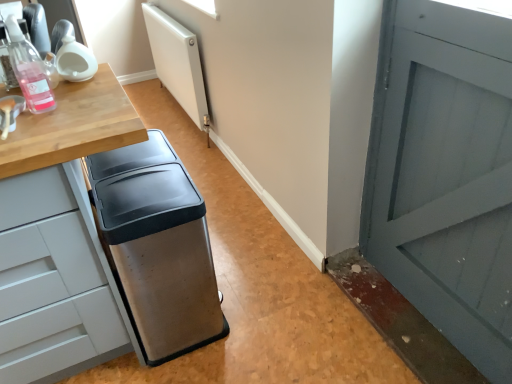
What do you see at coordinates (158, 246) in the screenshot? I see `stainless steel trash can at center` at bounding box center [158, 246].

In order to face stainless steel trash can at center, should I rotate leftwards or rightwards?

Rotate left and turn 13.049 degrees.

Identify the location of translucent plastic bottle at left. The height and width of the screenshot is (384, 512). (29, 70).

Where is `stainless steel trash can at center`? stainless steel trash can at center is located at coordinates (158, 246).

From the image's perspective, relative to white matte radiator at upper center, is translucent plastic bottle at left above or below?

translucent plastic bottle at left is below white matte radiator at upper center.

Is translucent plastic bottle at left far from white matte radiator at upper center?

translucent plastic bottle at left is far away from white matte radiator at upper center.

The image size is (512, 384). I want to click on bottle below the white matte radiator at upper center (from the image's perspective), so click(29, 70).

From a real-world perspective, is white matte radiator at upper center on top of stainless steel trash can at center?

Indeed, from a real-world perspective, white matte radiator at upper center stands above stainless steel trash can at center.

How different are the orientations of white matte radiator at upper center and stainless steel trash can at center in degrees?

They differ by 180 degrees in their facing directions.

Would you say white matte radiator at upper center is outside stainless steel trash can at center?

Yes, white matte radiator at upper center is not within stainless steel trash can at center.

Between white matte radiator at upper center and stainless steel trash can at center, which one appears on the right side from the viewer's perspective?

stainless steel trash can at center is more to the right.

Does stainless steel trash can at center turn towards white matte radiator at upper center?

No, stainless steel trash can at center is not facing towards white matte radiator at upper center.

Is point (192, 260) more distant than point (183, 72)?

That is False.

Locate an element on the screen. The image size is (512, 384). radiator above the stainless steel trash can at center (from the image's perspective) is located at coordinates (178, 64).

From a real-world perspective, is stainless steel trash can at center physically located above or below white matte radiator at upper center?

Clearly, from a real-world perspective, stainless steel trash can at center is below white matte radiator at upper center.

In the scene shown: From the image's perspective, is white matte radiator at upper center on translucent plastic bottle at left?

Indeed, from the image's perspective, white matte radiator at upper center is shown above translucent plastic bottle at left.

Which is nearer, (157, 56) or (11, 47)?

The point (11, 47) is more forward.

Which of these two, white matte radiator at upper center or translucent plastic bottle at left, is bigger?

With larger size is white matte radiator at upper center.

From a real-world perspective, which object rests below the other?

white matte radiator at upper center.

Based on the photo, who is smaller, translucent plastic bottle at left or stainless steel trash can at center?

Smaller between the two is translucent plastic bottle at left.

Is the surface of translucent plastic bottle at left in direct contact with stainless steel trash can at center?

No, translucent plastic bottle at left is not beside stainless steel trash can at center.

From a real-world perspective, between translucent plastic bottle at left and stainless steel trash can at center, who is vertically lower?

stainless steel trash can at center is physically lower.

From the image's perspective, is translucent plastic bottle at left below stainless steel trash can at center?

No, from the image's perspective, translucent plastic bottle at left is not below stainless steel trash can at center.

Is stainless steel trash can at center placed right next to translucent plastic bottle at left?

No, stainless steel trash can at center is not touching translucent plastic bottle at left.

Which object is further away from the camera taking this photo, stainless steel trash can at center or translucent plastic bottle at left?

stainless steel trash can at center is behind.

Would you say stainless steel trash can at center is outside translucent plastic bottle at left?

Yes, stainless steel trash can at center is outside of translucent plastic bottle at left.

Could you tell me if stainless steel trash can at center is turned towards translucent plastic bottle at left?

No, stainless steel trash can at center is not turned towards translucent plastic bottle at left.

The height and width of the screenshot is (384, 512). In order to click on bottle located above the white matte radiator at upper center (from a real-world perspective) in this screenshot , I will do (29, 70).

Find the location of a particular element. The width and height of the screenshot is (512, 384). waste container directly beneath the white matte radiator at upper center (from a real-world perspective) is located at coordinates (158, 246).

From the image, which object appears to be farther from stainless steel trash can at center, white matte radiator at upper center or translucent plastic bottle at left?

Based on the image, white matte radiator at upper center appears to be further to stainless steel trash can at center.

Considering their positions, is stainless steel trash can at center positioned closer to translucent plastic bottle at left than white matte radiator at upper center?

The object closer to translucent plastic bottle at left is stainless steel trash can at center.

Estimate the real-world distances between objects in this image. Which object is closer to translucent plastic bottle at left, white matte radiator at upper center or stainless steel trash can at center?

stainless steel trash can at center is closer to translucent plastic bottle at left.

Based on their spatial positions, is translucent plastic bottle at left or white matte radiator at upper center closer to stainless steel trash can at center?

Based on the image, translucent plastic bottle at left appears to be nearer to stainless steel trash can at center.

From the image, which object appears to be nearer to white matte radiator at upper center, stainless steel trash can at center or translucent plastic bottle at left?

stainless steel trash can at center.

From the image, which object appears to be nearer to white matte radiator at upper center, translucent plastic bottle at left or stainless steel trash can at center?

The object closer to white matte radiator at upper center is stainless steel trash can at center.

In order to click on waste container between translucent plastic bottle at left and white matte radiator at upper center from front to back in this screenshot , I will do `click(158, 246)`.